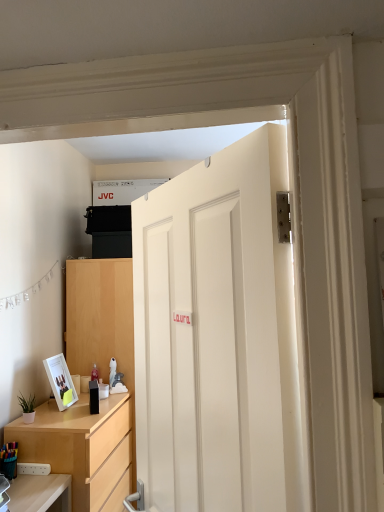
This screenshot has height=512, width=384. Describe the element at coordinates (9, 460) in the screenshot. I see `multicolored plastic pen holder at lower left` at that location.

Measure the distance between green matte plant at lower left and camera.

The depth of green matte plant at lower left is 2.37 meters.

The image size is (384, 512). I want to click on multicolored plastic pen holder at lower left, so click(9, 460).

Is multicolored plastic pen holder at lower left turned away from white glossy picture frame at lower left?

No, multicolored plastic pen holder at lower left is not facing away from white glossy picture frame at lower left.

From the picture: Is multicolored plastic pen holder at lower left not near white glossy picture frame at lower left?

No, multicolored plastic pen holder at lower left is not far away from white glossy picture frame at lower left.

Is multicolored plastic pen holder at lower left shorter than white glossy picture frame at lower left?

Yes, multicolored plastic pen holder at lower left is shorter than white glossy picture frame at lower left.

Who is smaller, white matte door at center or green matte plant at lower left?

With smaller size is green matte plant at lower left.

Choose the correct answer: Is white matte door at center inside green matte plant at lower left or outside it?

white matte door at center is not enclosed by green matte plant at lower left.

What's the angular difference between white matte door at center and green matte plant at lower left's facing directions?

They differ by 152 degrees in their facing directions.

Is white matte door at center oriented away from green matte plant at lower left?

white matte door at center does not have its back to green matte plant at lower left.

Would you consider light wood/texture dresser at lower left to be distant from white glossy picture frame at lower left?

No, there isn't a large distance between light wood/texture dresser at lower left and white glossy picture frame at lower left.

Could you tell me if light wood/texture dresser at lower left is turned towards white glossy picture frame at lower left?

No, light wood/texture dresser at lower left is not oriented towards white glossy picture frame at lower left.

From a real-world perspective, is light wood/texture dresser at lower left located higher than white glossy picture frame at lower left?

No, from a real-world perspective, light wood/texture dresser at lower left is not above white glossy picture frame at lower left.

Does white matte door at center have a smaller size compared to light wood/texture dresser at lower left?

Yes.

Is white matte door at center wider or thinner than light wood/texture dresser at lower left?

In the image, white matte door at center appears to be more narrow than light wood/texture dresser at lower left.

Is point (277, 463) positioned after point (72, 443)?

No, it is in front of (72, 443).

Is white matte door at center touching light wood/texture dresser at lower left?

No, white matte door at center is not touching light wood/texture dresser at lower left.

Does green matte plant at lower left turn towards multicolored plastic pen holder at lower left?

No, green matte plant at lower left is not aimed at multicolored plastic pen holder at lower left.

From a real-world perspective, relative to multicolored plastic pen holder at lower left, is green matte plant at lower left vertically above or below?

Clearly, from a real-world perspective, green matte plant at lower left is above multicolored plastic pen holder at lower left.

Is multicolored plastic pen holder at lower left located within green matte plant at lower left?

No, green matte plant at lower left does not contain multicolored plastic pen holder at lower left.

Based on the photo, measure the distance between green matte plant at lower left and multicolored plastic pen holder at lower left.

green matte plant at lower left and multicolored plastic pen holder at lower left are 9.43 inches apart from each other.

In the scene shown: Is green matte plant at lower left to the right of white glossy picture frame at lower left from the viewer's perspective?

In fact, green matte plant at lower left is to the left of white glossy picture frame at lower left.

What's the angular difference between green matte plant at lower left and white glossy picture frame at lower left's facing directions?

green matte plant at lower left and white glossy picture frame at lower left are facing 2.11 degrees away from each other.

From the picture: Would you say green matte plant at lower left is outside white glossy picture frame at lower left?

Yes.

From a real-world perspective, is green matte plant at lower left physically above white glossy picture frame at lower left?

No, from a real-world perspective, green matte plant at lower left is not on top of white glossy picture frame at lower left.

Considering the relative sizes of white matte door at center and multicolored plastic pen holder at lower left in the image provided, is white matte door at center shorter than multicolored plastic pen holder at lower left?

No.

Which of these two, white matte door at center or multicolored plastic pen holder at lower left, is thinner?

With smaller width is multicolored plastic pen holder at lower left.

Is the surface of white matte door at center in direct contact with multicolored plastic pen holder at lower left?

No, white matte door at center is not making contact with multicolored plastic pen holder at lower left.

Image resolution: width=384 pixels, height=512 pixels. Find the location of `stationery in front of the white glossy picture frame at lower left`. stationery in front of the white glossy picture frame at lower left is located at coordinates (9, 460).

Locate an element on the screen. houseplant below the white matte door at center (from a real-world perspective) is located at coordinates (27, 408).

Looking at the image, which one is located closer to white matte door at center, light wood/texture dresser at lower left or white glossy picture frame at lower left?

light wood/texture dresser at lower left is closer to white matte door at center.

From the image, which object appears to be farther from light wood/texture dresser at lower left, green matte plant at lower left or white matte door at center?

white matte door at center is positioned further to the anchor light wood/texture dresser at lower left.

Which object lies further to the anchor point green matte plant at lower left, white matte door at center or light wood/texture dresser at lower left?

white matte door at center lies further to green matte plant at lower left than the other object.

When comparing their distances from light wood/texture dresser at lower left, does white matte door at center or green matte plant at lower left seem closer?

The object closer to light wood/texture dresser at lower left is green matte plant at lower left.

Which object lies nearer to the anchor point green matte plant at lower left, white glossy picture frame at lower left or multicolored plastic pen holder at lower left?

Among the two, white glossy picture frame at lower left is located nearer to green matte plant at lower left.

Which object lies further to the anchor point white matte door at center, white glossy picture frame at lower left or light wood/texture dresser at lower left?

Based on the image, white glossy picture frame at lower left appears to be further to white matte door at center.

Which object lies further to the anchor point white glossy picture frame at lower left, white matte door at center or green matte plant at lower left?

white matte door at center is further to white glossy picture frame at lower left.

Considering their positions, is white glossy picture frame at lower left positioned closer to multicolored plastic pen holder at lower left than green matte plant at lower left?

green matte plant at lower left is closer to multicolored plastic pen holder at lower left.

Locate an element on the screen. houseplant between multicolored plastic pen holder at lower left and white glossy picture frame at lower left in the front-back direction is located at coordinates (27, 408).

Image resolution: width=384 pixels, height=512 pixels. I want to click on stationery between white matte door at center and light wood/texture dresser at lower left along the z-axis, so click(x=9, y=460).

Image resolution: width=384 pixels, height=512 pixels. I want to click on houseplant between white glossy picture frame at lower left and light wood/texture dresser at lower left vertically, so click(x=27, y=408).

In order to click on cabinetry between white matte door at center and green matte plant at lower left along the z-axis in this screenshot , I will do `click(83, 447)`.